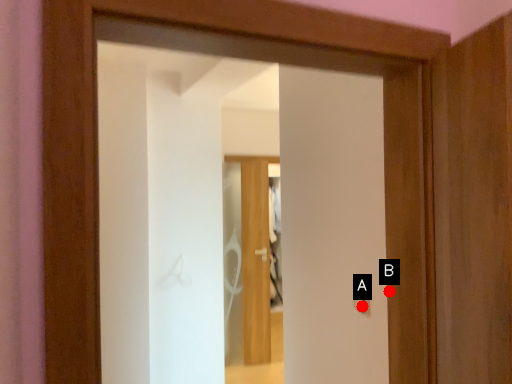
Question: Two points are circled on the image, labeled by A and B beside each circle. Which point is further to the camera?

Choices:
 (A) A is further
 (B) B is further

Answer: (A)